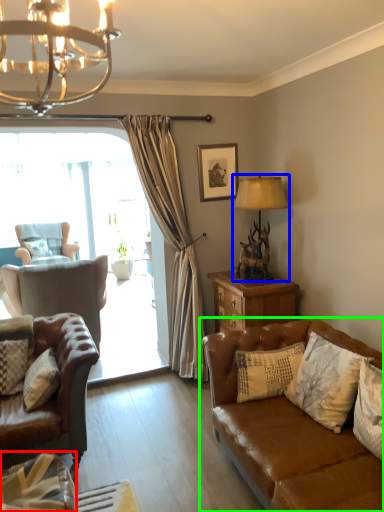
Question: Based on their relative distances, which object is farther from pillow (highlighted by a red box)? Choose from lamp (highlighted by a blue box) and studio couch (highlighted by a green box).

Choices:
 (A) lamp
 (B) studio couch

Answer: (A)